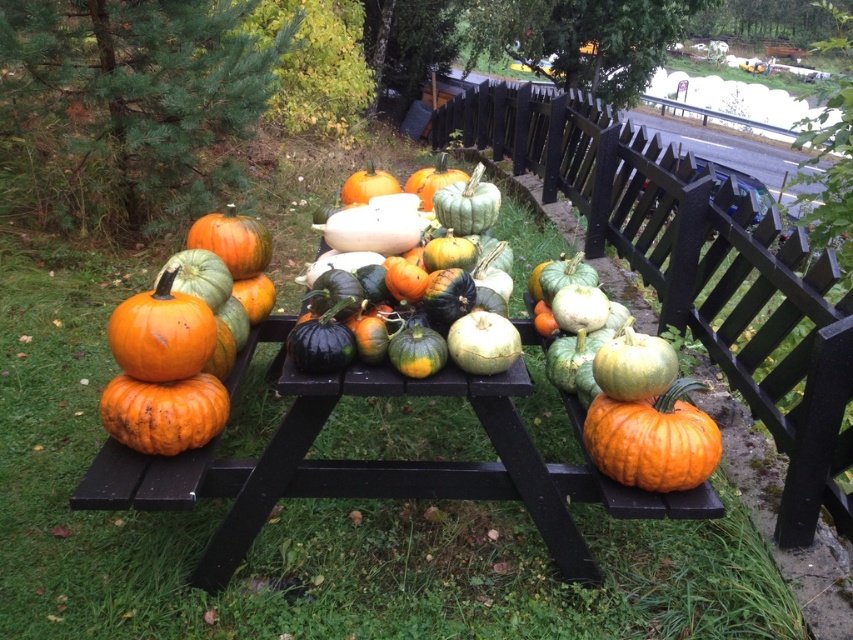
Does black wood fence at center appear on the left side of green matte gourds at center?

In fact, black wood fence at center is to the right of green matte gourds at center.

Is black wood fence at center below green matte gourds at center?

Actually, black wood fence at center is above green matte gourds at center.

Does point (782, 515) lie behind point (369, 339)?

Yes, point (782, 515) is behind point (369, 339).

Locate an element on the screen. black wood fence at center is located at coordinates (694, 269).

Is black wood fence at center wider than orange matte pumpkin at center?

Correct, the width of black wood fence at center exceeds that of orange matte pumpkin at center.

Describe the element at coordinates (694, 269) in the screenshot. I see `black wood fence at center` at that location.

Which is behind, point (787, 330) or point (614, 435)?

The point (787, 330) is more distant.

You are a GUI agent. You are given a task and a screenshot of the screen. Output one action in this format:
    pyautogui.click(x=<x>, y=<y>)
    Task: Click on the black wood fence at center
    This screenshot has width=853, height=640.
    Given the screenshot: What is the action you would take?
    pyautogui.click(x=694, y=269)

Consider the image. Does black wood fence at center appear on the left side of orange matte pumpkin at lower left?

No, black wood fence at center is not to the left of orange matte pumpkin at lower left.

Can you confirm if black wood fence at center is positioned to the right of orange matte pumpkin at lower left?

Indeed, black wood fence at center is positioned on the right side of orange matte pumpkin at lower left.

The image size is (853, 640). I want to click on black wood fence at center, so [694, 269].